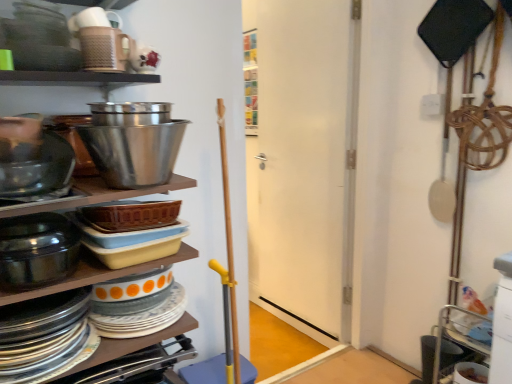
Question: Is shiny metallic bowl at left, the third bowl in the top-to-bottom sequence, situated inside white matte door at center or outside?

Choices:
 (A) inside
 (B) outside

Answer: (B)

Question: Considering the positions of shiny metallic bowl at left, positioned as the first bowl in bottom-to-top order, and white matte door at center in the image, is shiny metallic bowl at left, positioned as the first bowl in bottom-to-top order, bigger or smaller than white matte door at center?

Choices:
 (A) small
 (B) big

Answer: (A)

Question: Based on their relative distances, which object is farther from the matte orange and white platter at left?

Choices:
 (A) matte ceramic dishes at left
 (B) porcelain plates at left
 (C) shiny metallic bowl at left, positioned as the first bowl in bottom-to-top order
 (D) shiny metallic bowl at upper center, arranged as the 3th bowl when ordered from the bottom
 (E) white matte door at center

Answer: (E)

Question: Which of these objects is positioned closest to the porcelain plates at left?

Choices:
 (A) shiny metallic bowl at upper center, marked as the 1th bowl in a top-to-bottom arrangement
 (B) matte black bowl at left, acting as the 2th bowl starting from the top
 (C) matte orange and white platter at left
 (D) shiny metallic bowl at left, the third bowl in the top-to-bottom sequence
 (E) white matte door at center

Answer: (C)